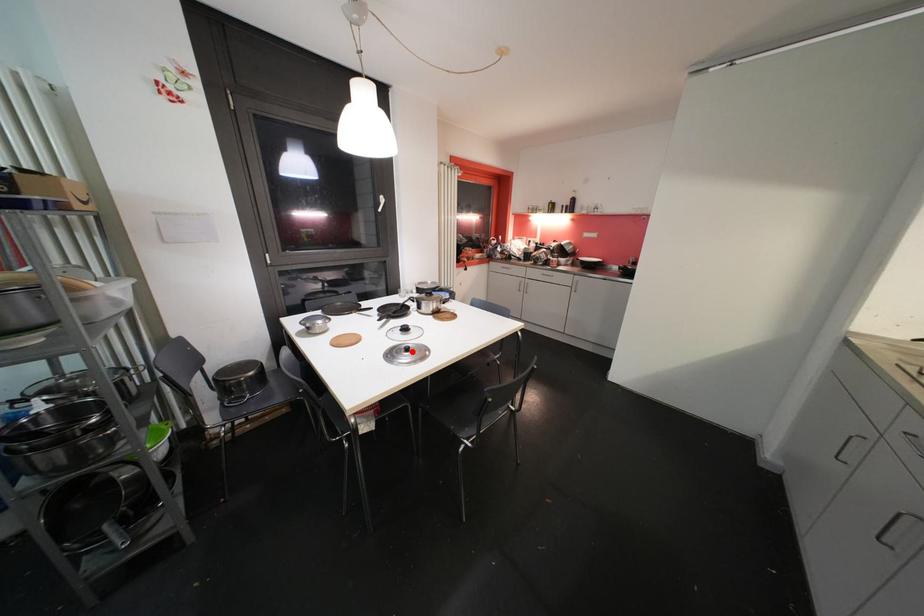
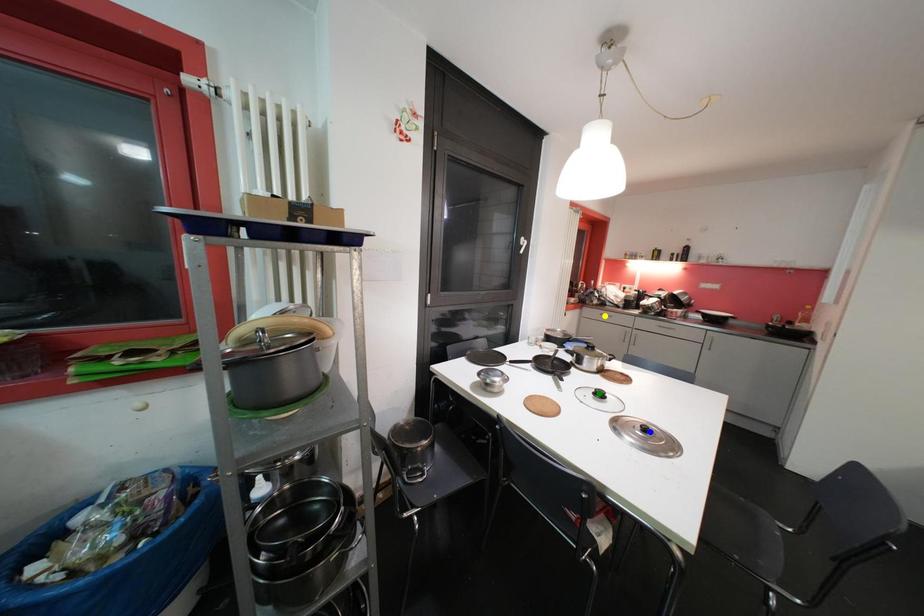
Question: I am providing you with two images of the same scene from different viewpoints. A red point is marked on the first image. You are given multiple points on the second image. Can you choose the point in image 2 that corresponds to the point in image 1?

Choices:
 (A) blue point
 (B) yellow point
 (C) green point

Answer: (A)